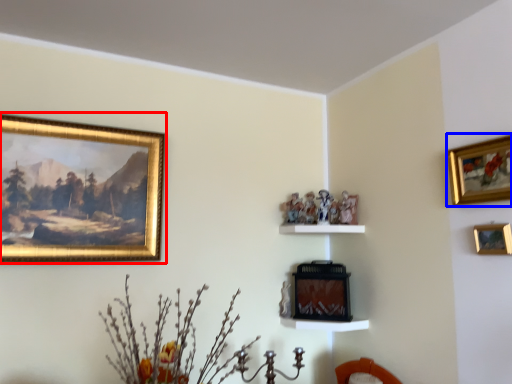
Question: Which of the following is the closest to the observer, picture frame (highlighted by a red box) or picture frame (highlighted by a blue box)?

Choices:
 (A) picture frame
 (B) picture frame

Answer: (B)